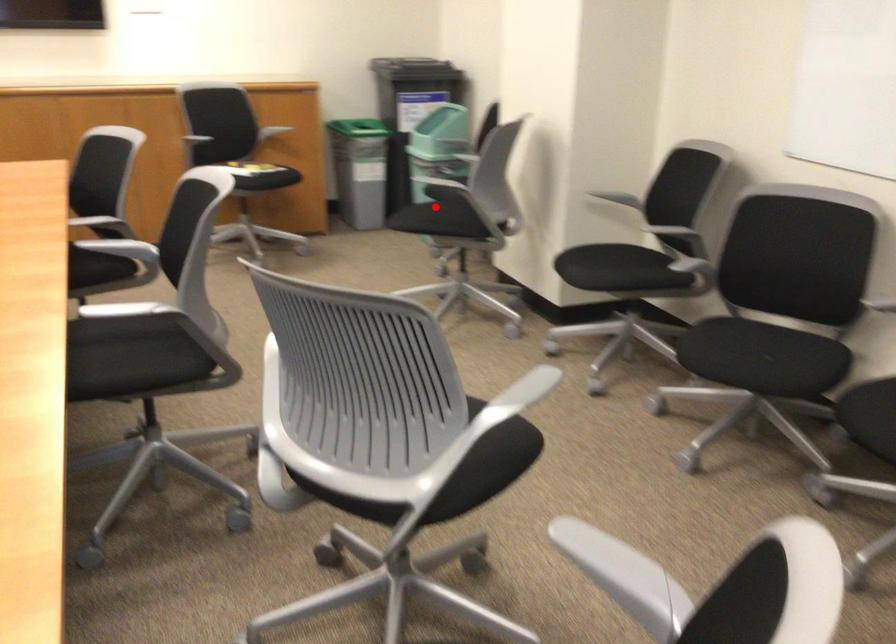
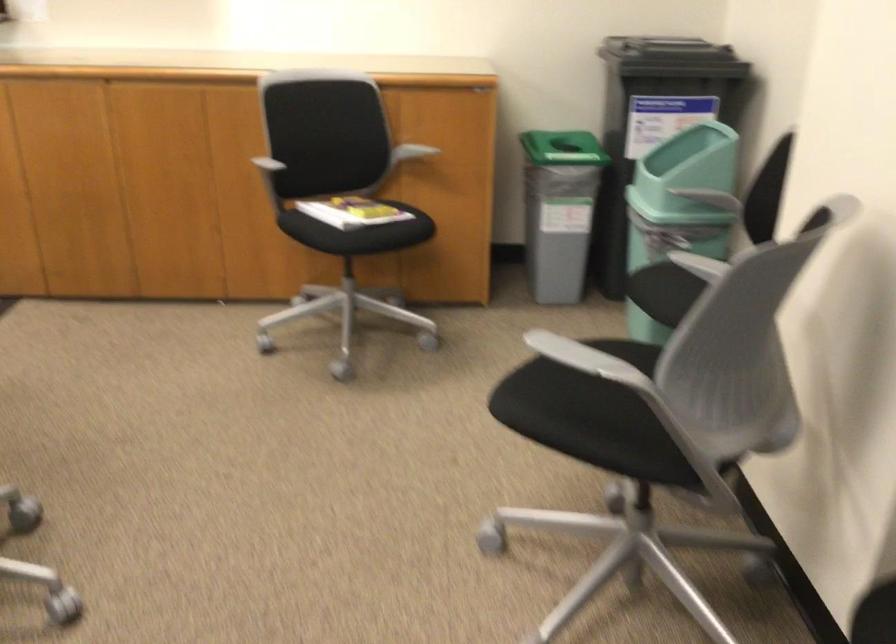
In the second image, find the point that corresponds to the highlighted location in the first image.

(599, 406)